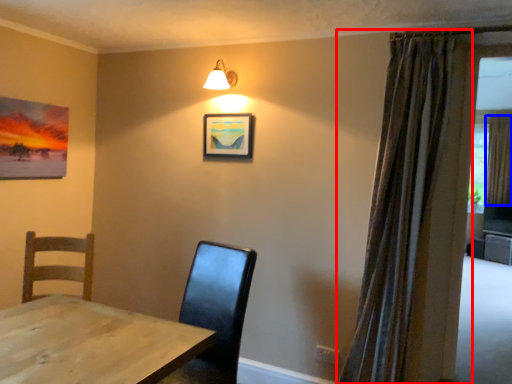
Question: Which of the following is the farthest to the observer, curtain (highlighted by a red box) or curtain (highlighted by a blue box)?

Choices:
 (A) curtain
 (B) curtain

Answer: (B)